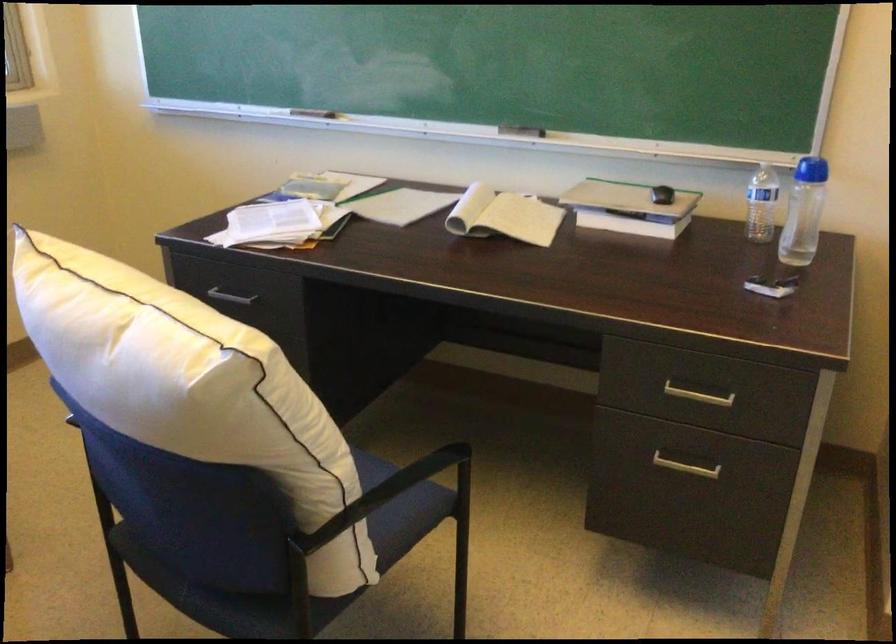
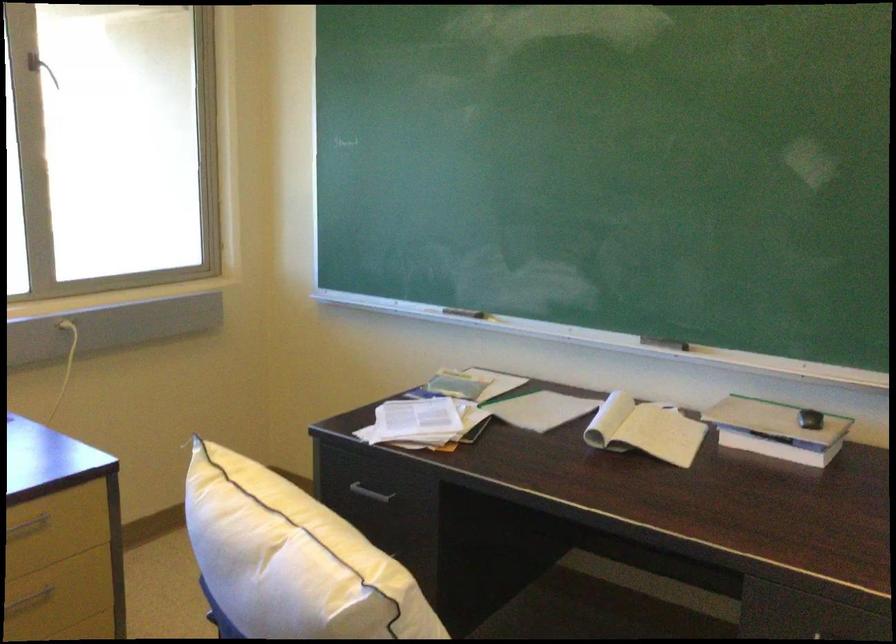
Where in the second image is the point corresponding to point 519,135 from the first image?

(664, 343)